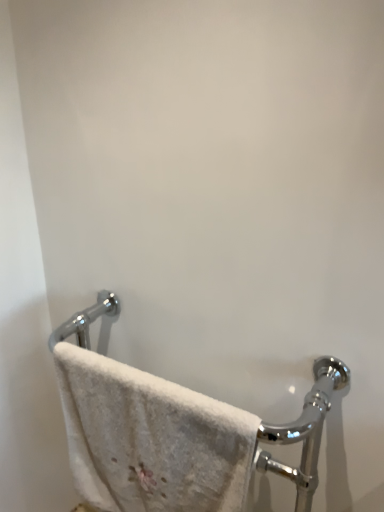
What do you see at coordinates (150, 439) in the screenshot? I see `white fluffy towel at lower left` at bounding box center [150, 439].

The width and height of the screenshot is (384, 512). Identify the location of white fluffy towel at lower left. (150, 439).

The width and height of the screenshot is (384, 512). What are the coordinates of `white fluffy towel at lower left` in the screenshot? It's located at (150, 439).